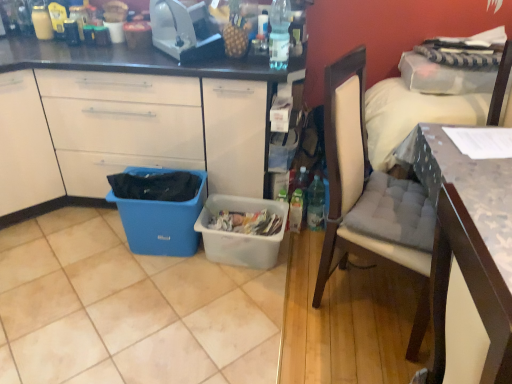
I want to click on vacant space underneath blue plastic bin at lower left (from a real-world perspective), so click(140, 195).